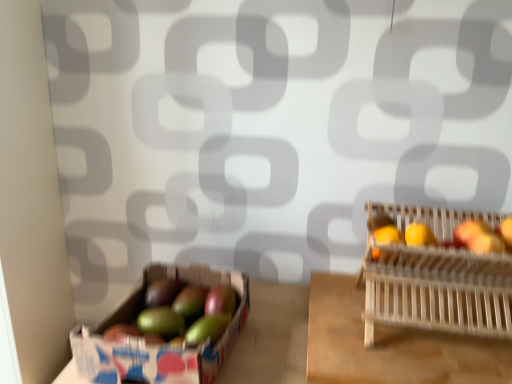
Where is `vacant region to the right of green matte mango at lower left, positioned as the second apple in left-to-right order`? vacant region to the right of green matte mango at lower left, positioned as the second apple in left-to-right order is located at coordinates (269, 322).